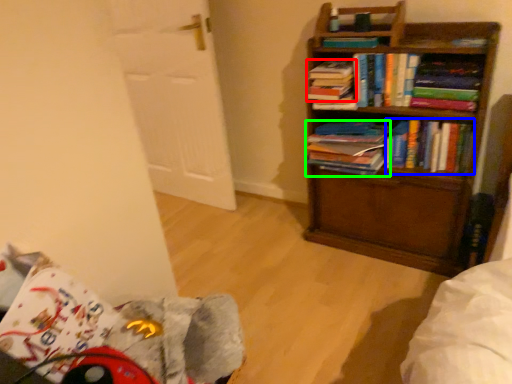
Question: Considering the real-world distances, which object is closest to book (highlighted by a red box)? book (highlighted by a blue box) or book (highlighted by a green box).

Choices:
 (A) book
 (B) book

Answer: (B)